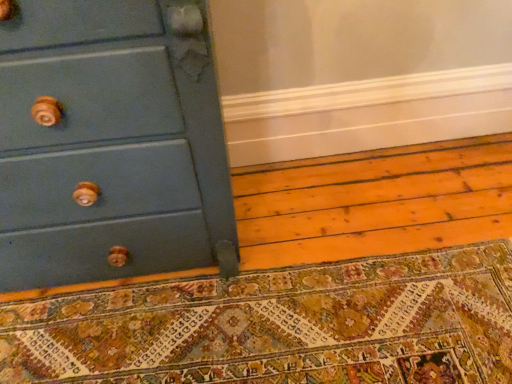
The width and height of the screenshot is (512, 384). What do you see at coordinates (110, 143) in the screenshot? I see `matte teal chest of drawers at lower left` at bounding box center [110, 143].

Image resolution: width=512 pixels, height=384 pixels. I want to click on matte teal chest of drawers at lower left, so click(110, 143).

What is the approximate width of matte teal chest of drawers at lower left?

matte teal chest of drawers at lower left is 21.71 inches in width.

What is the approximate height of matte teal chest of drawers at lower left?

The height of matte teal chest of drawers at lower left is 35.00 inches.

Identify the location of matte teal chest of drawers at lower left. (110, 143).